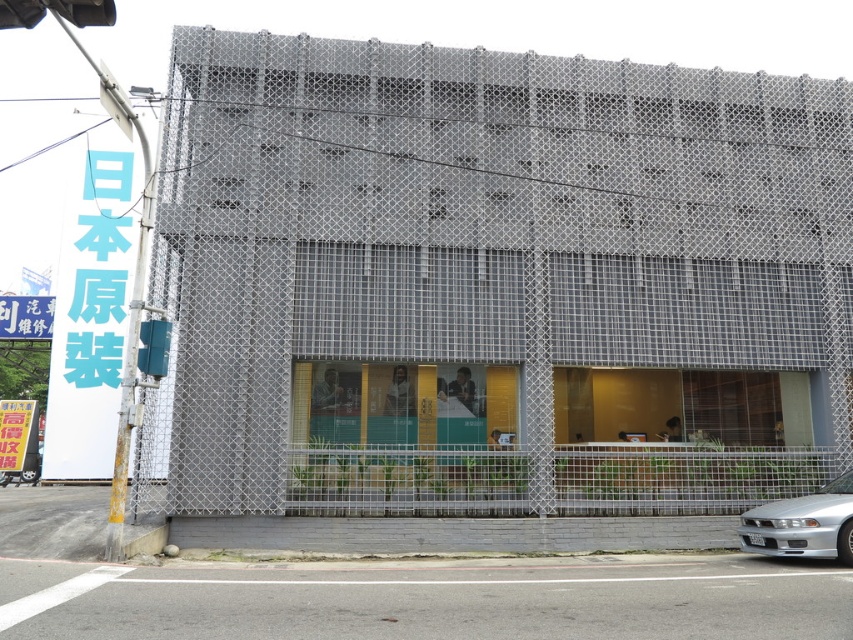
You are standing in front of the building and want to walk from the point at coordinates point (x=685, y=284) to the point at coordinates point (x=799, y=534). According to the scene description, which direction should you move to reach your destination?

Since point (x=685, y=284) is behind point (x=799, y=534), you should move forward to reach the destination.

Based on the scene description, what are the coordinates of the matte gray building at center?

The coordinates of the matte gray building at center are at point [494,284].

You are standing in front of the modern building with a distinctive facade. You notice a point marked at coordinates (494, 284). What object is located at this point?

The matte gray building at center is located at point (494, 284).